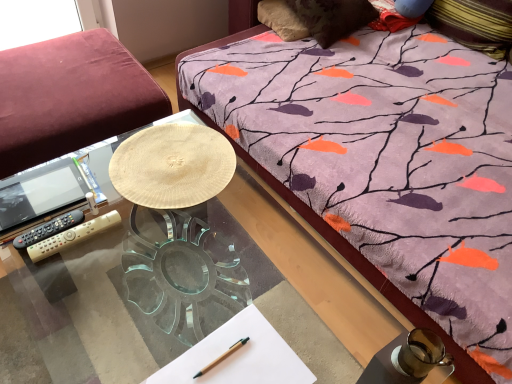
Identify the location of free spot above white paper at center (from a real-world perspective). (228, 359).